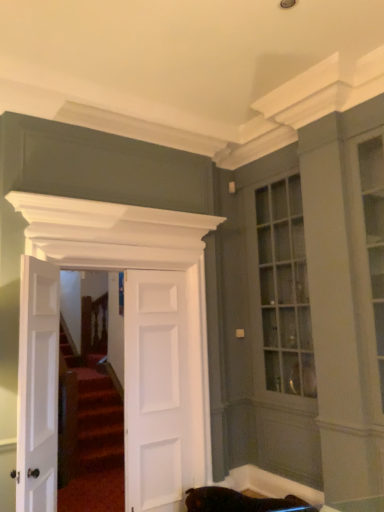
The image size is (384, 512). What are the coordinates of `white matte door at center, which is counted as the 2th door, starting from the left` in the screenshot? It's located at (129, 262).

Considering the points (163, 450) and (39, 301), which point is behind, point (163, 450) or point (39, 301)?

The point (163, 450) is farther.

Which is more to the left, white matte door at center, the 3th door positioned from the left, or white matte door at left, the 3th door when ordered from right to left?

Positioned to the left is white matte door at left, the 3th door when ordered from right to left.

Is white matte door at center, the 3th door positioned from the left, positioned with its back to white matte door at left, marked as the first door in a left-to-right arrangement?

white matte door at center, the 3th door positioned from the left, is not turned away from white matte door at left, marked as the first door in a left-to-right arrangement.

This screenshot has height=512, width=384. What are the coordinates of `door that appears below the white matte door at center, which is counted as the 2th door, starting from the left (from a real-world perspective)` in the screenshot? It's located at coord(156,391).

Is white matte door at center, the 2th door positioned from the right, smaller than white matte door at center, the 3th door positioned from the left?

No.

Could you tell me if white matte door at center, the 2th door positioned from the right, is turned towards white matte door at center, the 3th door positioned from the left?

Yes.

How many degrees apart are the facing directions of white matte door at center, which is counted as the 2th door, starting from the left, and white matte door at center, the 3th door positioned from the left?

They differ by 0.00843 degrees in their facing directions.

Is point (18, 366) more distant than point (209, 418)?

That is False.

Is white matte door at left, marked as the first door in a left-to-right arrangement, shorter than white matte door at center, the 2th door positioned from the right?

Correct, white matte door at left, marked as the first door in a left-to-right arrangement, is not as tall as white matte door at center, the 2th door positioned from the right.

Does white matte door at center, the 2th door positioned from the right, have a larger size compared to white matte door at left, the 3th door when ordered from right to left?

Yes, white matte door at center, the 2th door positioned from the right, is bigger than white matte door at left, the 3th door when ordered from right to left.

Considering the sizes of objects white matte door at center, the 2th door positioned from the right, and white matte door at left, the 3th door when ordered from right to left, in the image provided, who is thinner, white matte door at center, the 2th door positioned from the right, or white matte door at left, the 3th door when ordered from right to left,?

Thinner between the two is white matte door at center, the 2th door positioned from the right.

Can you confirm if white matte door at center, which is counted as the 2th door, starting from the left, is shorter than white matte door at left, the 3th door when ordered from right to left?

Answer: In fact, white matte door at center, which is counted as the 2th door, starting from the left, may be taller than white matte door at left, the 3th door when ordered from right to left.

Is white matte door at center, the 2th door positioned from the right, a part of white matte door at center, arranged as the first door when viewed from the right?

No, white matte door at center, arranged as the first door when viewed from the right, does not contain white matte door at center, the 2th door positioned from the right.

Locate an element on the screen. The height and width of the screenshot is (512, 384). door behind the white matte door at center, which is counted as the 2th door, starting from the left is located at coordinates (156, 391).

Is white matte door at center, the 3th door positioned from the left, in front of or behind white matte door at center, the 2th door positioned from the right, in the image?

Visually, white matte door at center, the 3th door positioned from the left, is located behind white matte door at center, the 2th door positioned from the right.

From the image's perspective, does white matte door at center, arranged as the first door when viewed from the right, appear lower than white matte door at center, the 2th door positioned from the right?

Yes, from the image's perspective, white matte door at center, arranged as the first door when viewed from the right, is below white matte door at center, the 2th door positioned from the right.

From the image's perspective, would you say white matte door at left, the 3th door when ordered from right to left, is positioned over white matte door at center, the 3th door positioned from the left?

Yes, from the image's perspective, white matte door at left, the 3th door when ordered from right to left, is above white matte door at center, the 3th door positioned from the left.

Which is in front, white matte door at left, marked as the first door in a left-to-right arrangement, or white matte door at center, arranged as the first door when viewed from the right?

white matte door at left, marked as the first door in a left-to-right arrangement, is more forward.

Does white matte door at left, the 3th door when ordered from right to left, have a greater width compared to white matte door at center, arranged as the first door when viewed from the right?

Indeed, white matte door at left, the 3th door when ordered from right to left, has a greater width compared to white matte door at center, arranged as the first door when viewed from the right.

Is white matte door at left, the 3th door when ordered from right to left, in contact with white matte door at center, arranged as the first door when viewed from the right?

They are not placed beside each other.

You are a GUI agent. You are given a task and a screenshot of the screen. Output one action in this format:
    pyautogui.click(x=<x>, y=<y>)
    Task: Click on the 2nd door in front of the white matte door at center, the 3th door positioned from the left
    
    Given the screenshot: What is the action you would take?
    pyautogui.click(x=38, y=386)

From the image's perspective, starting from the white matte door at center, arranged as the first door when viewed from the right, which door is the 1st one above? Please provide its 2D coordinates.

[(129, 262)]

Which object lies nearer to the anchor point white matte door at left, the 3th door when ordered from right to left, white matte door at center, the 3th door positioned from the left, or white matte door at center, which is counted as the 2th door, starting from the left?

white matte door at center, which is counted as the 2th door, starting from the left, is closer to white matte door at left, the 3th door when ordered from right to left.

Which object lies nearer to the anchor point white matte door at left, the 3th door when ordered from right to left, white matte door at center, the 2th door positioned from the right, or white matte door at center, arranged as the first door when viewed from the right?

white matte door at center, the 2th door positioned from the right.

Based on their spatial positions, is white matte door at left, the 3th door when ordered from right to left, or white matte door at center, the 2th door positioned from the right, further from white matte door at center, arranged as the first door when viewed from the right?

white matte door at left, the 3th door when ordered from right to left.

From the image, which object appears to be farther from white matte door at center, the 2th door positioned from the right, white matte door at center, arranged as the first door when viewed from the right, or white matte door at left, marked as the first door in a left-to-right arrangement?

The object further to white matte door at center, the 2th door positioned from the right, is white matte door at left, marked as the first door in a left-to-right arrangement.

When comparing their distances from white matte door at center, the 2th door positioned from the right, does white matte door at left, the 3th door when ordered from right to left, or white matte door at center, the 3th door positioned from the left, seem closer?

white matte door at center, the 3th door positioned from the left.

Based on their spatial positions, is white matte door at center, which is counted as the 2th door, starting from the left, or white matte door at left, the 3th door when ordered from right to left, closer to white matte door at center, arranged as the first door when viewed from the right?

white matte door at center, which is counted as the 2th door, starting from the left, is closer to white matte door at center, arranged as the first door when viewed from the right.

The image size is (384, 512). I want to click on door between white matte door at left, the 3th door when ordered from right to left, and white matte door at center, the 3th door positioned from the left, along the z-axis, so click(129, 262).